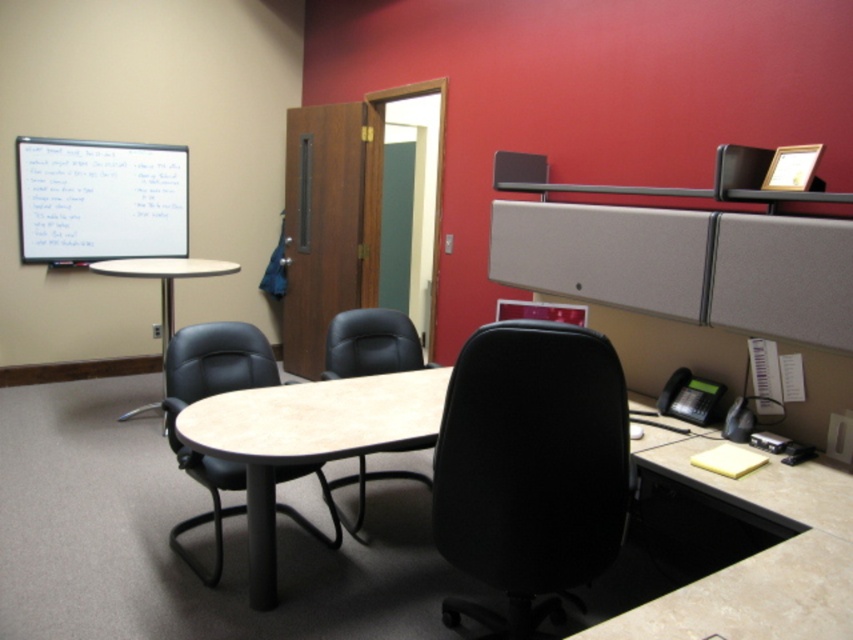
You are setting up a presentation in the office. You need to know if the white matte projection screen at upper left can fit horizontally across the width of the black leather chair at center. Based on the scene description, can it?

The white matte projection screen at upper left is wider than the black leather chair at center, so it can fit horizontally across the chair.